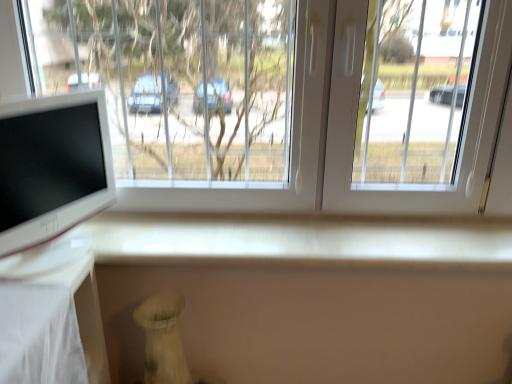
Question: Considering the positions of transparent glass window at upper center and white glossy computer monitor at left in the image, is transparent glass window at upper center bigger or smaller than white glossy computer monitor at left?

Choices:
 (A) small
 (B) big

Answer: (B)

Question: Is transparent glass window at upper center in front of or behind white glossy computer monitor at left in the image?

Choices:
 (A) behind
 (B) front

Answer: (A)

Question: Which is correct: transparent glass window at upper center is inside white glossy computer monitor at left, or outside of it?

Choices:
 (A) outside
 (B) inside

Answer: (A)

Question: Relative to transparent glass window at upper center, is white glossy computer monitor at left in front or behind?

Choices:
 (A) behind
 (B) front

Answer: (B)

Question: Is white glossy computer monitor at left taller or shorter than transparent glass window at upper center?

Choices:
 (A) tall
 (B) short

Answer: (B)

Question: Visually, is white glossy computer monitor at left positioned to the left or to the right of transparent glass window at upper center?

Choices:
 (A) left
 (B) right

Answer: (A)

Question: Looking at their shapes, would you say white glossy computer monitor at left is wider or thinner than transparent glass window at upper center?

Choices:
 (A) thin
 (B) wide

Answer: (A)